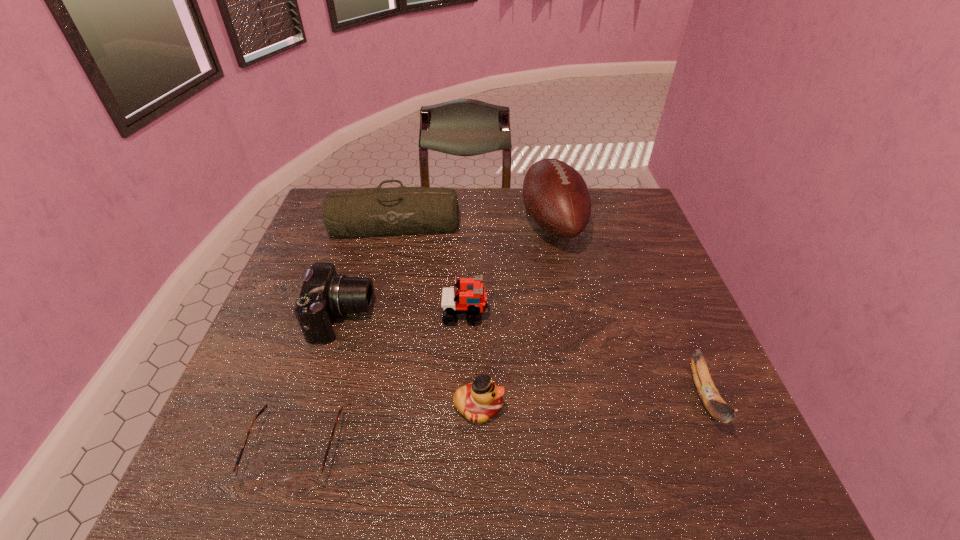
Image resolution: width=960 pixels, height=540 pixels. What are the coordinates of `the tallest object` in the screenshot? It's located at (556, 197).

At what (x,y) coordinates should I click in order to perform the action: click on football (American). Please return your answer as a coordinate pair (x, y). The height and width of the screenshot is (540, 960). Looking at the image, I should click on (556, 197).

The height and width of the screenshot is (540, 960). I want to click on duffel bag, so click(364, 212).

Where is `camera`? camera is located at coordinates (325, 294).

At what (x,y) coordinates should I click in order to perform the action: click on Lego. Please return your answer as a coordinate pair (x, y). The width and height of the screenshot is (960, 540). Looking at the image, I should click on (473, 301).

Identify the location of the rightmost object. Image resolution: width=960 pixels, height=540 pixels. click(717, 407).

Find the location of `duck`. duck is located at coordinates (481, 400).

This screenshot has height=540, width=960. Identify the location of spectacles. (303, 483).

Find the location of a particular element. The width and height of the screenshot is (960, 540). vacant space located 0.260m on the front of the football (American) is located at coordinates (574, 329).

This screenshot has height=540, width=960. In order to click on vacant point located on the right of the duffel bag in this screenshot , I will do `click(478, 224)`.